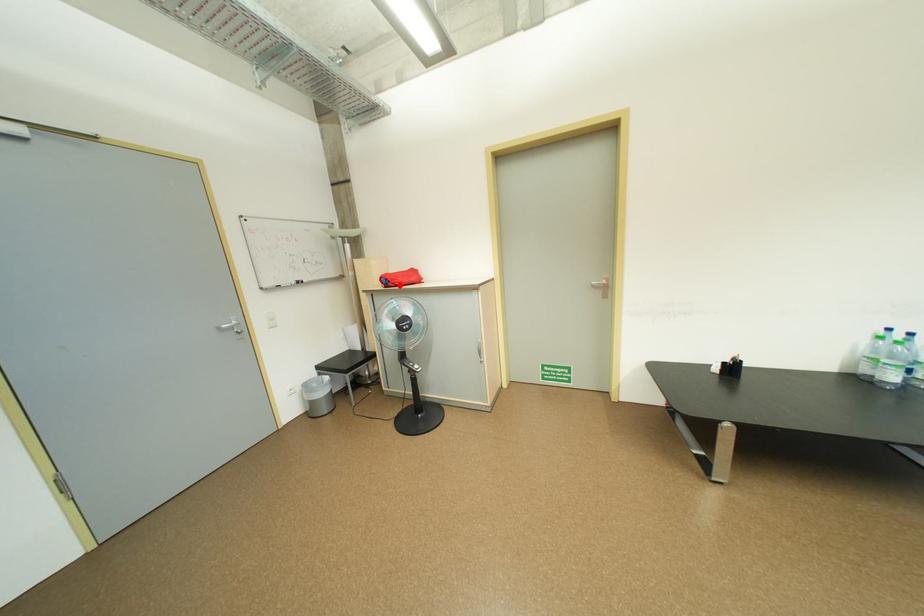
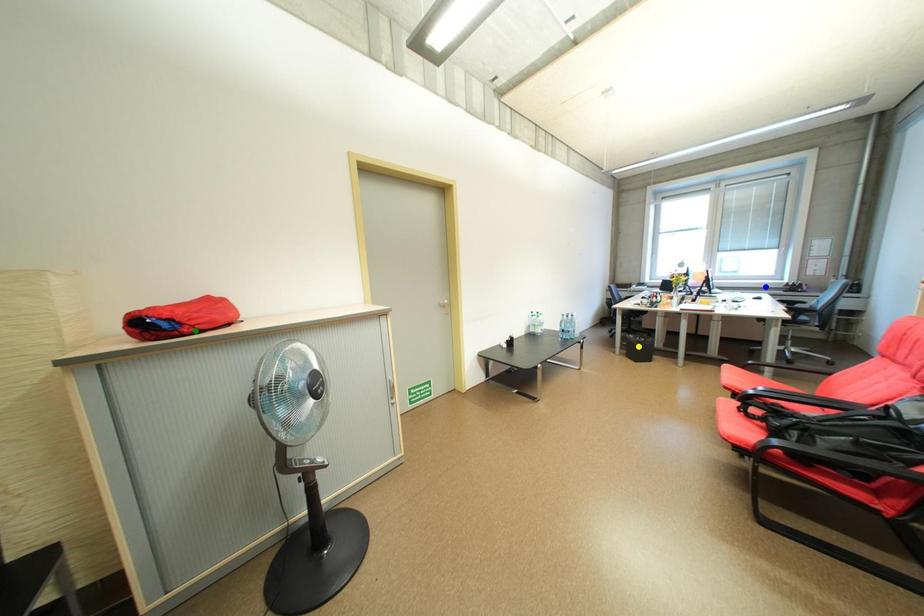
Question: I am providing you with two images of the same scene from different viewpoints. A red point is marked on the first image. You are given multiple points on the second image. Can you choose the point in image 2 that corresponds to the point in image 1?

Choices:
 (A) yellow point
 (B) green point
 (C) blue point

Answer: (B)